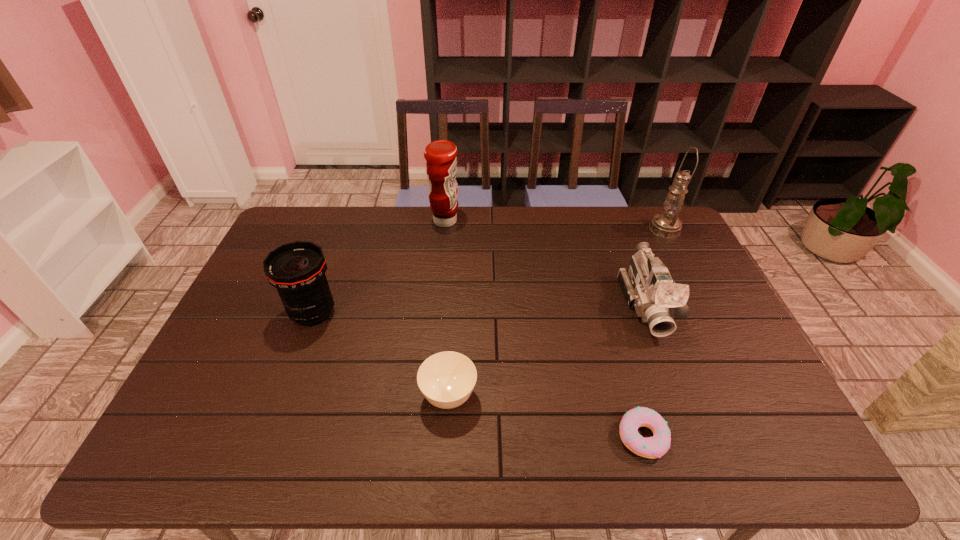
This screenshot has height=540, width=960. What are the coordinates of `oil lamp` in the screenshot? It's located at (667, 224).

Where is `condiment`? This screenshot has height=540, width=960. condiment is located at coordinates (441, 163).

Where is `telephoto lens`? telephoto lens is located at coordinates (297, 270).

This screenshot has width=960, height=540. In order to click on camcorder in this screenshot , I will do `click(647, 285)`.

Find the location of a particular element. The image size is (960, 540). the fifth tallest object is located at coordinates (446, 379).

Identify the location of the shortest object. The width and height of the screenshot is (960, 540). (653, 447).

Find the location of a particular element. doughnut is located at coordinates (653, 447).

The image size is (960, 540). Identify the location of vacant space situated on the left of the rightmost object. (548, 229).

Locate an element on the screen. The image size is (960, 540). vacant space positioned on the left of the condiment is located at coordinates pos(382,221).

Where is `vacant position located on the left of the telephoto lens`? This screenshot has width=960, height=540. vacant position located on the left of the telephoto lens is located at coordinates (271, 313).